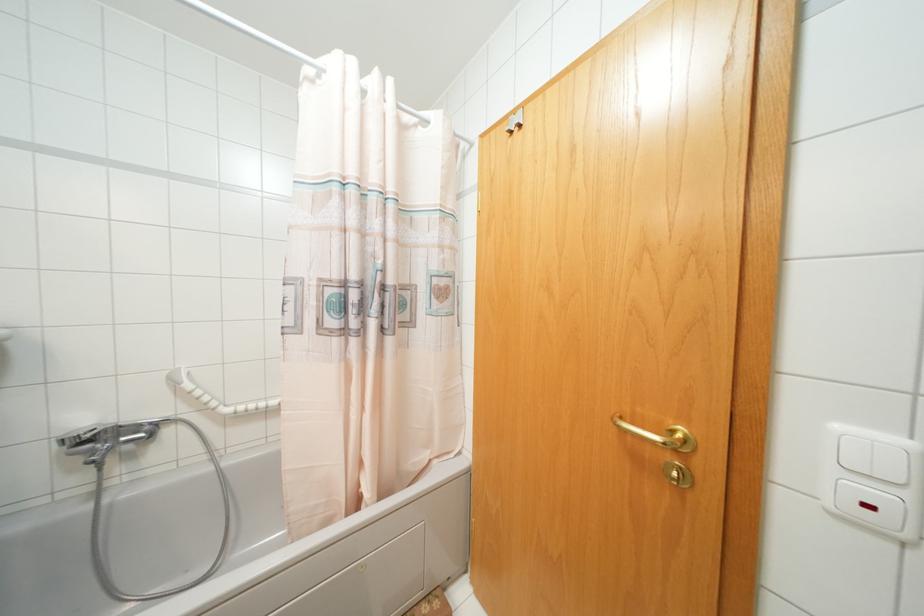
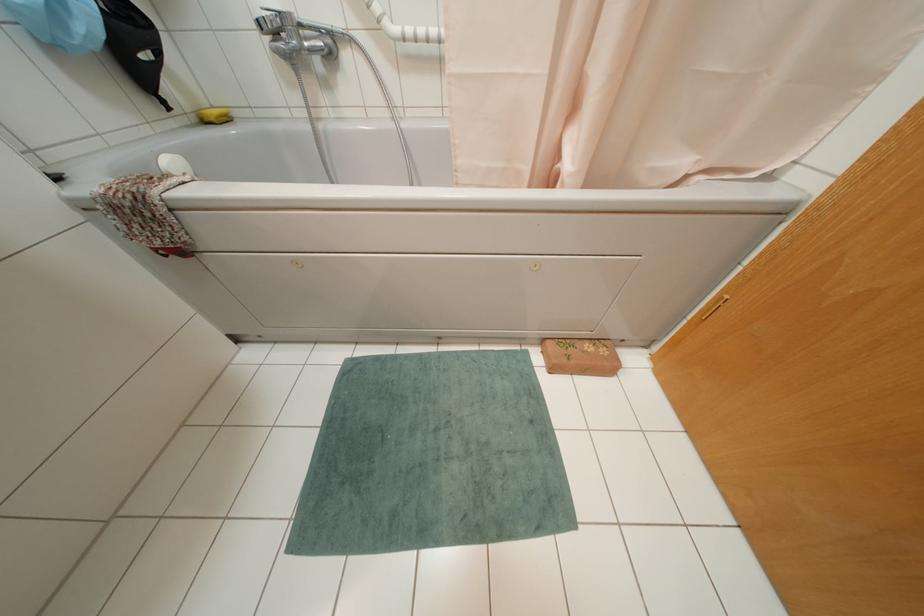
The point at (x=103, y=430) is marked in the first image. Where is the corresponding point in the second image?

(278, 12)